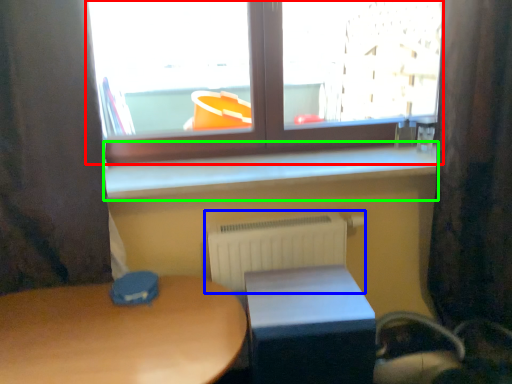
Question: Which is nearer to the window (highlighted by a red box)? radiator (highlighted by a blue box) or window sill (highlighted by a green box).

Choices:
 (A) radiator
 (B) window sill

Answer: (B)